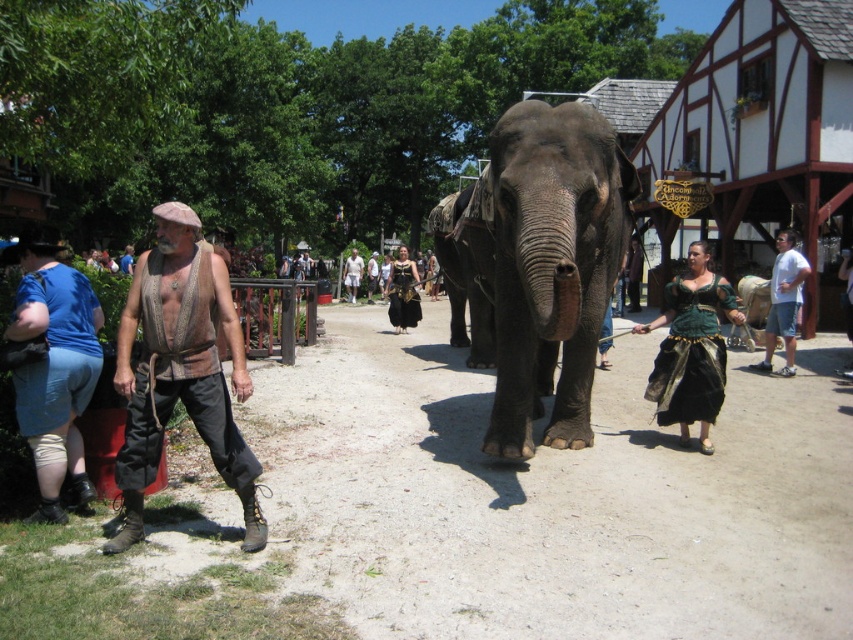
You are a photographer at the fair and want to take a picture of the green velvet dress at center. Where should you position your camera to capture it in the frame?

To capture the green velvet dress at center, position your camera at the center of the image, specifically at coordinates point (691,348).

You are a photographer at the fair and want to capture both the dark gray textured elephant at center and the green velvet dress at center in a single photo. Which object should you focus on first to ensure both are in frame?

The dark gray textured elephant at center is larger than the green velvet dress at center, so you should focus on the elephant first to ensure both fit within the frame.

You are a photographer at the fair and want to capture the dark gray textured elephant at center and the green velvet dress at center in a single photo. Which object should you focus on first to ensure both are in frame?

The dark gray textured elephant at center is much taller than the green velvet dress at center, so you should focus on the elephant first to ensure both are in frame.